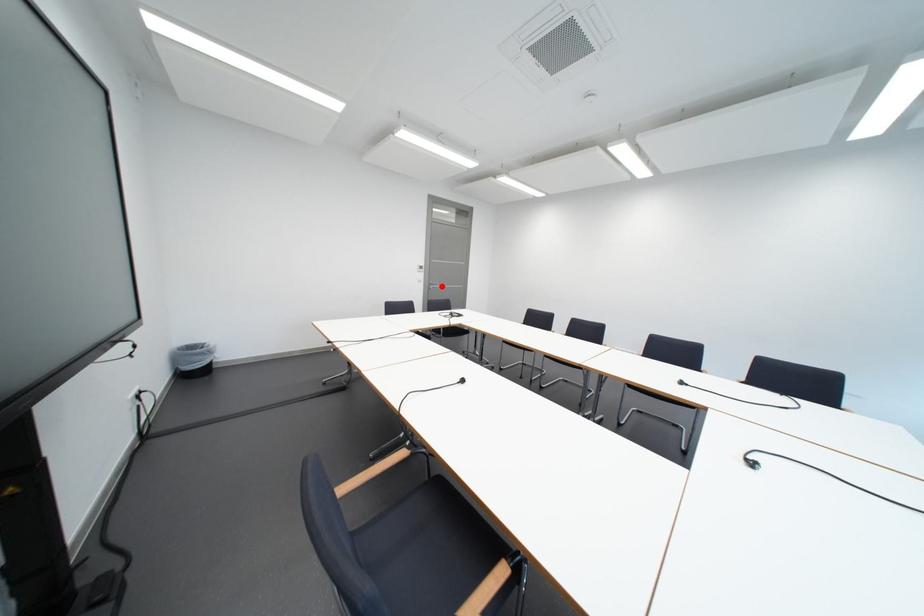
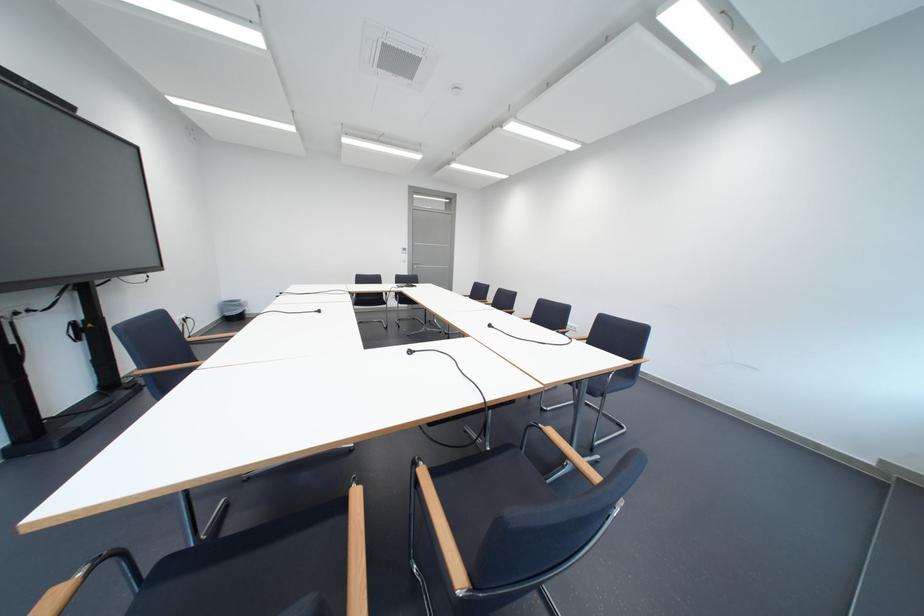
Question: I am providing you with two images of the same scene from different viewpoints. Given a red point in image1, look at the same physical point in image2. Is it:

Choices:
 (A) Closer to the viewpoint
 (B) Farther from the viewpoint

Answer: (A)